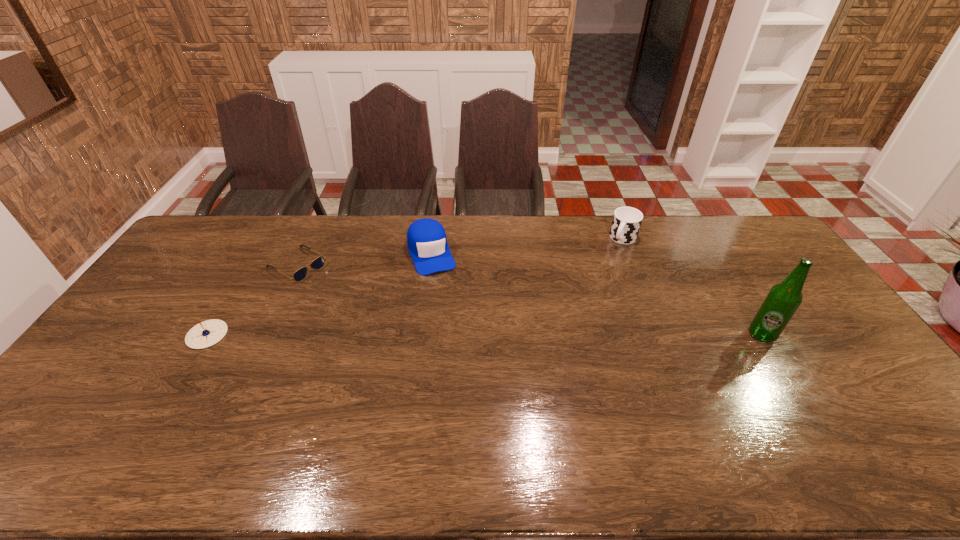
Locate an element on the screen. The width and height of the screenshot is (960, 540). sunglasses at the far edge is located at coordinates (318, 263).

Find the location of `cup that is at the far edge`. cup that is at the far edge is located at coordinates (626, 222).

Find the location of a particular element. Image resolution: width=960 pixels, height=540 pixels. blank space at the far edge is located at coordinates (609, 221).

Identify the location of free space at the near edge of the desktop. (x=323, y=399).

The height and width of the screenshot is (540, 960). I want to click on free region at the left edge of the desktop, so click(168, 305).

Identify the location of free space at the right edge of the desktop. [x=838, y=345].

At what (x,y) coordinates should I click in order to perform the action: click on free space between the third object from right to left and the leftmost object. Please return your answer as a coordinate pair (x, y). This screenshot has height=540, width=960. Looking at the image, I should click on (320, 294).

You are a GUI agent. You are given a task and a screenshot of the screen. Output one action in this format:
    pyautogui.click(x=<x>, y=<y>)
    Task: Click on the free point between the baseball cap and the beer bottle
    
    Given the screenshot: What is the action you would take?
    pyautogui.click(x=596, y=294)

Locate an element on the screen. vacant area that lies between the rightmost object and the leftmost object is located at coordinates (x=485, y=335).

I want to click on unoccupied position between the baseball cap and the fourth object from right to left, so click(x=364, y=259).